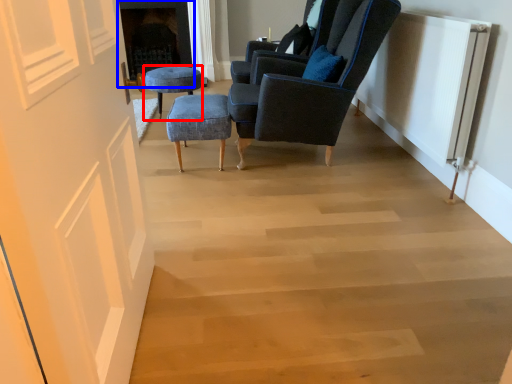
Question: Which of the following is the farthest to the observer, stool (highlighted by a red box) or fireplace (highlighted by a blue box)?

Choices:
 (A) stool
 (B) fireplace

Answer: (B)